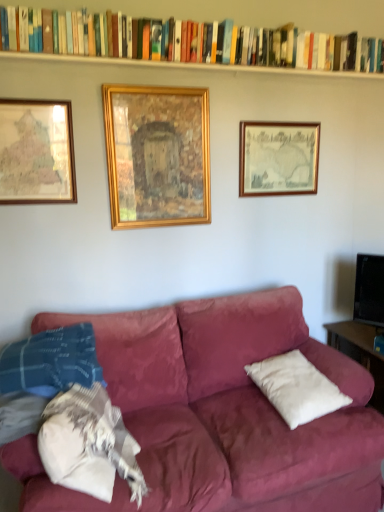
Where is `white soft cushion at right`? The image size is (384, 512). white soft cushion at right is located at coordinates (296, 388).

What is the approximate width of white soft cushion at right?

It is 15.37 inches.

What do you see at coordinates (186, 65) in the screenshot?
I see `white painted wood at upper center` at bounding box center [186, 65].

This screenshot has height=512, width=384. What do you see at coordinates (246, 12) in the screenshot? I see `hardcover book at upper center` at bounding box center [246, 12].

I want to click on wooden framed map at upper right, the third picture frame viewed from the left, so pos(278,158).

Locate an element on the screen. This screenshot has height=512, width=384. gold wooden frame at center, the 2th picture frame from the right is located at coordinates (157, 155).

What are the coordinates of `white soft cushion at right` in the screenshot? It's located at (296, 388).

From a real-world perspective, does white painted wood at upper center stand above wooden framed map at upper right, the first picture frame in the right-to-left sequence?

Yes, from a real-world perspective, white painted wood at upper center is above wooden framed map at upper right, the first picture frame in the right-to-left sequence.

Measure the distance between white painted wood at upper center and wooden framed map at upper right, the third picture frame viewed from the left.

white painted wood at upper center and wooden framed map at upper right, the third picture frame viewed from the left, are 51.89 centimeters apart.

Looking at this image, is white painted wood at upper center taller or shorter than wooden framed map at upper right, the first picture frame in the right-to-left sequence?

In the image, white painted wood at upper center appears to be shorter than wooden framed map at upper right, the first picture frame in the right-to-left sequence.

Is white painted wood at upper center oriented away from wooden framed map at upper right, the third picture frame viewed from the left?

That's not correct — white painted wood at upper center is not looking away from wooden framed map at upper right, the third picture frame viewed from the left.

Is wooden framed map at upper right, the first picture frame in the right-to-left sequence, completely or partially inside white soft cushion at right?

That's incorrect, wooden framed map at upper right, the first picture frame in the right-to-left sequence, is not inside white soft cushion at right.

From the image's perspective, who appears lower, white soft cushion at right or wooden framed map at upper right, the third picture frame viewed from the left?

white soft cushion at right, from the image's perspective.

Which is more to the right, white soft cushion at right or wooden framed map at upper right, the first picture frame in the right-to-left sequence?

wooden framed map at upper right, the first picture frame in the right-to-left sequence.

Does point (304, 377) come in front of point (313, 175)?

Yes, it is.

Based on the photo, which is correct: white soft cushion at right is inside hardcover book at upper center, or outside of it?

white soft cushion at right is outside hardcover book at upper center.

In terms of height, does white soft cushion at right look taller or shorter compared to hardcover book at upper center?

white soft cushion at right is shorter than hardcover book at upper center.

Based on the photo, is wooden framed map at upper right, the first picture frame in the right-to-left sequence, wider or thinner than white painted wood at upper center?

Considering their sizes, wooden framed map at upper right, the first picture frame in the right-to-left sequence, looks slimmer than white painted wood at upper center.

From the image's perspective, which one is positioned higher, wooden framed map at upper right, the first picture frame in the right-to-left sequence, or white painted wood at upper center?

white painted wood at upper center, from the image's perspective.

From a real-world perspective, is wooden framed map at upper right, the first picture frame in the right-to-left sequence, physically located above or below white painted wood at upper center?

From a real-world perspective, wooden framed map at upper right, the first picture frame in the right-to-left sequence, is physically below white painted wood at upper center.

Considering the sizes of white painted wood at upper center and gold wooden frame at center, the 2th picture frame from the right, in the image, is white painted wood at upper center taller or shorter than gold wooden frame at center, the 2th picture frame from the right,?

white painted wood at upper center is shorter than gold wooden frame at center, the 2th picture frame from the right.

From a real-world perspective, is white painted wood at upper center above or below gold wooden frame at center, the 2th picture frame from the right?

From a real-world perspective, white painted wood at upper center is physically above gold wooden frame at center, the 2th picture frame from the right.

From the picture: Considering the sizes of white painted wood at upper center and gold wooden frame at center, the 2th picture frame from the right, in the image, is white painted wood at upper center wider or thinner than gold wooden frame at center, the 2th picture frame from the right,?

Considering their sizes, white painted wood at upper center looks broader than gold wooden frame at center, the 2th picture frame from the right.

Is white painted wood at upper center facing towards gold wooden frame at center, the 2th picture frame from the right?

No, white painted wood at upper center does not turn towards gold wooden frame at center, the 2th picture frame from the right.

From the image's perspective, between hardcover book at upper center and gold wooden frame at center, the 2th picture frame from the right, who is located below?

gold wooden frame at center, the 2th picture frame from the right, is shown below in the image.

Identify the location of book above the gold wooden frame at center, the 2th picture frame from the left (from a real-world perspective). (246, 12).

Which object is closer to the camera taking this photo, hardcover book at upper center or gold wooden frame at center, the 2th picture frame from the right?

hardcover book at upper center is more forward.

Is gold wooden frame at center, the 2th picture frame from the left, next to hardcover book at upper center?

No, gold wooden frame at center, the 2th picture frame from the left, is not beside hardcover book at upper center.

Who is smaller, gold wooden frame at center, the 2th picture frame from the right, or hardcover book at upper center?

gold wooden frame at center, the 2th picture frame from the right, is smaller.

Locate an element on the screen. The width and height of the screenshot is (384, 512). picture frame that is the 2nd object located below the hardcover book at upper center (from the image's perspective) is located at coordinates (157, 155).

Which of these two, gold wooden frame at center, the 2th picture frame from the right, or hardcover book at upper center, is thinner?

gold wooden frame at center, the 2th picture frame from the right, is thinner.

Locate an element on the screen. the 1st picture frame positioned below the white painted wood at upper center (from the image's perspective) is located at coordinates (278, 158).

In order to click on pillow in front of the wooden framed map at upper right, the first picture frame in the right-to-left sequence in this screenshot , I will do `click(296, 388)`.

Estimate the real-world distances between objects in this image. Which object is further from wooden map at left, which ranks as the 3th picture frame in right-to-left order, wooden framed map at upper right, the first picture frame in the right-to-left sequence, or white soft cushion at right?

Among the two, white soft cushion at right is located further to wooden map at left, which ranks as the 3th picture frame in right-to-left order.

Which object lies nearer to the anchor point white soft cushion at right, gold wooden frame at center, the 2th picture frame from the right, or wooden framed map at upper right, the third picture frame viewed from the left?

gold wooden frame at center, the 2th picture frame from the right.

Looking at the image, which one is located closer to wooden map at left, placed as the 1th picture frame when sorted from left to right, white soft cushion at right or wooden framed map at upper right, the first picture frame in the right-to-left sequence?

Based on the image, wooden framed map at upper right, the first picture frame in the right-to-left sequence, appears to be nearer to wooden map at left, placed as the 1th picture frame when sorted from left to right.

Based on the photo, estimate the real-world distances between objects in this image. Which object is closer to hardcover book at upper center, white soft cushion at right or wooden framed map at upper right, the third picture frame viewed from the left?

Based on the image, wooden framed map at upper right, the third picture frame viewed from the left, appears to be nearer to hardcover book at upper center.

Looking at the image, which one is located closer to gold wooden frame at center, the 2th picture frame from the right, wooden framed map at upper right, the first picture frame in the right-to-left sequence, or white soft cushion at right?

wooden framed map at upper right, the first picture frame in the right-to-left sequence.

Considering their positions, is white painted wood at upper center positioned closer to white soft cushion at right than wooden map at left, which ranks as the 3th picture frame in right-to-left order?

wooden map at left, which ranks as the 3th picture frame in right-to-left order, is positioned closer to the anchor white soft cushion at right.

From the image, which object appears to be nearer to hardcover book at upper center, wooden map at left, which ranks as the 3th picture frame in right-to-left order, or wooden framed map at upper right, the first picture frame in the right-to-left sequence?

Among the two, wooden map at left, which ranks as the 3th picture frame in right-to-left order, is located nearer to hardcover book at upper center.

When comparing their distances from white painted wood at upper center, does white soft cushion at right or gold wooden frame at center, the 2th picture frame from the right, seem further?

white soft cushion at right.

The height and width of the screenshot is (512, 384). In order to click on pillow between wooden map at left, placed as the 1th picture frame when sorted from left to right, and wooden framed map at upper right, the third picture frame viewed from the left, in the horizontal direction in this screenshot , I will do `click(296, 388)`.

Find the location of a particular element. This screenshot has height=512, width=384. book situated between wooden map at left, which ranks as the 3th picture frame in right-to-left order, and wooden framed map at upper right, the first picture frame in the right-to-left sequence, from left to right is located at coordinates (246, 12).

Find the location of a particular element. Image resolution: width=384 pixels, height=512 pixels. shelf between hardcover book at upper center and gold wooden frame at center, the 2th picture frame from the right, vertically is located at coordinates (186, 65).

Where is `shelf between hardcover book at upper center and white soft cushion at right from top to bottom`? shelf between hardcover book at upper center and white soft cushion at right from top to bottom is located at coordinates (186, 65).